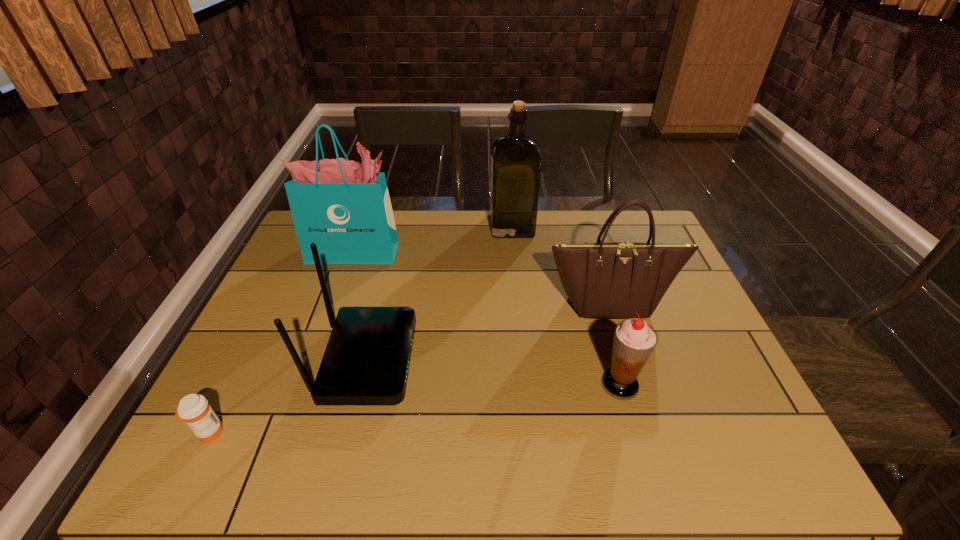
At what (x,y) coordinates should I click in order to perform the action: click on liquor. Please return your answer as a coordinate pair (x, y). Looking at the image, I should click on click(x=516, y=158).

I want to click on the second farthest object, so click(x=344, y=207).

Image resolution: width=960 pixels, height=540 pixels. What are the coordinates of `the third tallest object` in the screenshot? It's located at (612, 280).

Image resolution: width=960 pixels, height=540 pixels. What are the coordinates of `router` in the screenshot? It's located at (366, 361).

This screenshot has width=960, height=540. In order to click on the fifth tallest object in this screenshot , I will do `click(634, 340)`.

Identify the location of the shortest object. (194, 409).

Locate an element on the screen. This screenshot has width=960, height=540. the nearest object is located at coordinates (194, 409).

What are the coordinates of `free space located 0.060m on the label of the farthest object` in the screenshot? It's located at (473, 225).

The image size is (960, 540). I want to click on vacant space located 0.180m on the label of the farthest object, so click(x=438, y=225).

At what (x,y) coordinates should I click in order to perform the action: click on vacant space located 0.210m on the label of the farthest object. Please return your answer as a coordinate pair (x, y). Looking at the image, I should click on (429, 225).